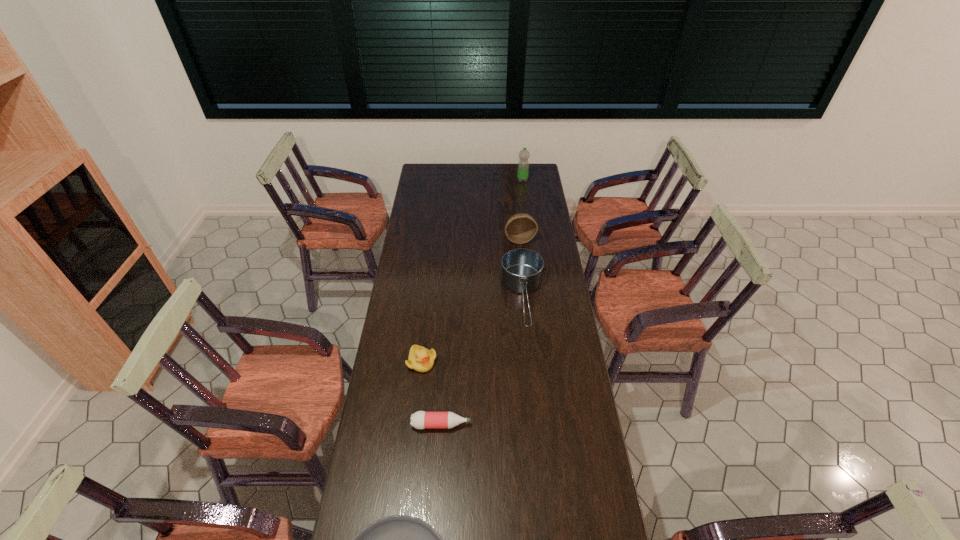
At what (x,y) coordinates should I click in order to perform the action: click on free space that satisfies the following two spatial constraints: 1. on the back side of the second tallest object; 2. on the left side of the water bottle. Please return your answer as a coordinate pair (x, y). The height and width of the screenshot is (540, 960). Looking at the image, I should click on (514, 180).